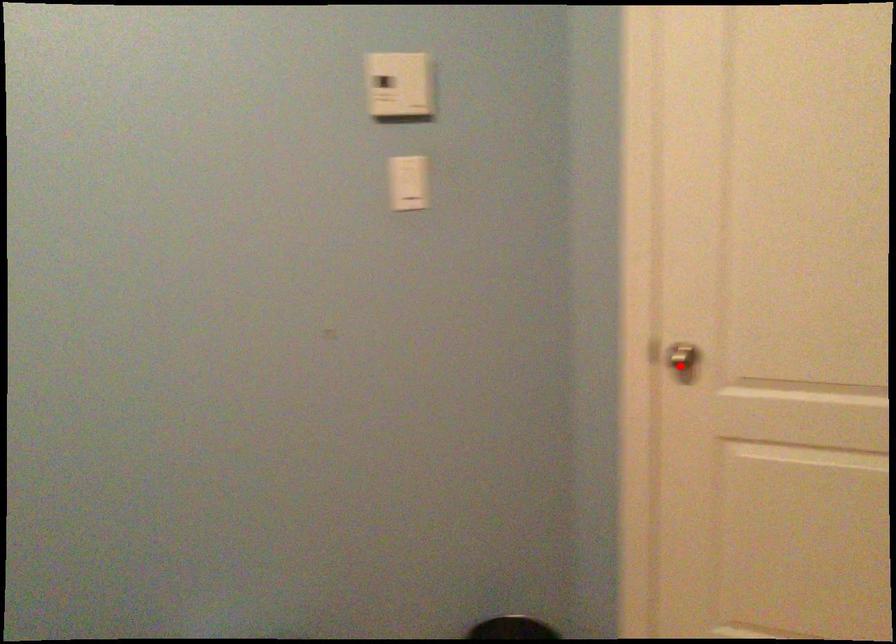
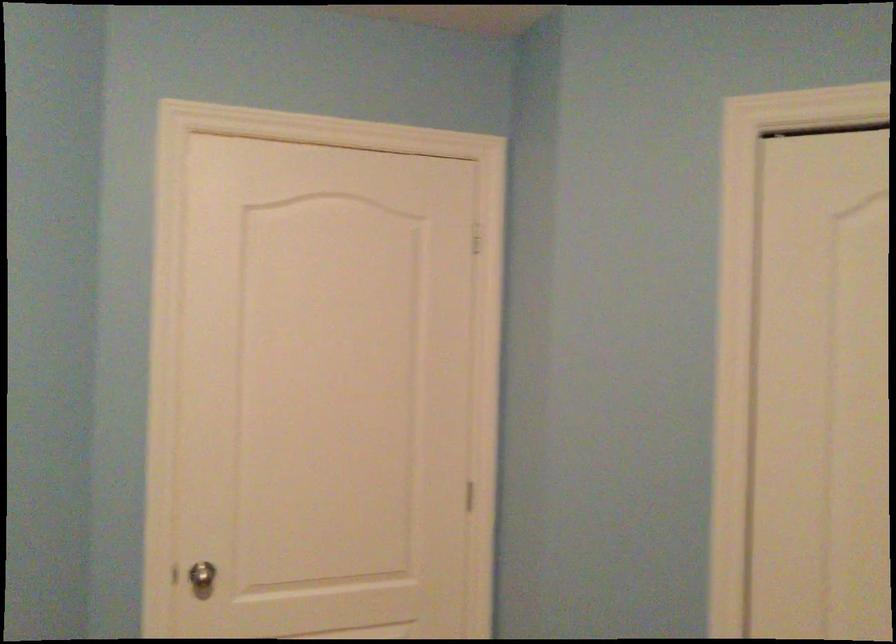
Where in the second image is the point corresponding to the highlighted location from the first image?

(202, 578)